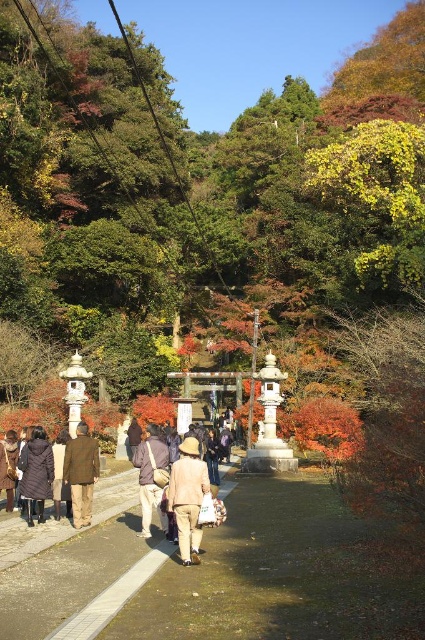
Is smooth concrete pavement at center positioned at the back of dark brown down jacket at lower left?

That is False.

Who is taller, smooth concrete pavement at center or dark brown down jacket at lower left?

With more height is dark brown down jacket at lower left.

Does point (147, 554) lie in front of point (48, 449)?

That is True.

Find the location of a particular element. This screenshot has height=640, width=425. smooth concrete pavement at center is located at coordinates (78, 582).

Consider the image. Who is more forward, (84, 452) or (11, 461)?

Point (84, 452)

Can you confirm if brown woolen coat at center is positioned above dark brown leather jacket at lower left?

Indeed, brown woolen coat at center is positioned over dark brown leather jacket at lower left.

This screenshot has height=640, width=425. In order to click on brown woolen coat at center in this screenshot , I will do `click(81, 474)`.

Which of these two, brown leather jacket at center or dark brown down jacket at lower left, stands shorter?

With less height is dark brown down jacket at lower left.

Consider the image. Who is higher up, brown leather jacket at center or dark brown down jacket at lower left?

dark brown down jacket at lower left is above.

The image size is (425, 640). Describe the element at coordinates (152, 476) in the screenshot. I see `brown leather jacket at center` at that location.

In order to click on brown leather jacket at center in this screenshot , I will do `click(152, 476)`.